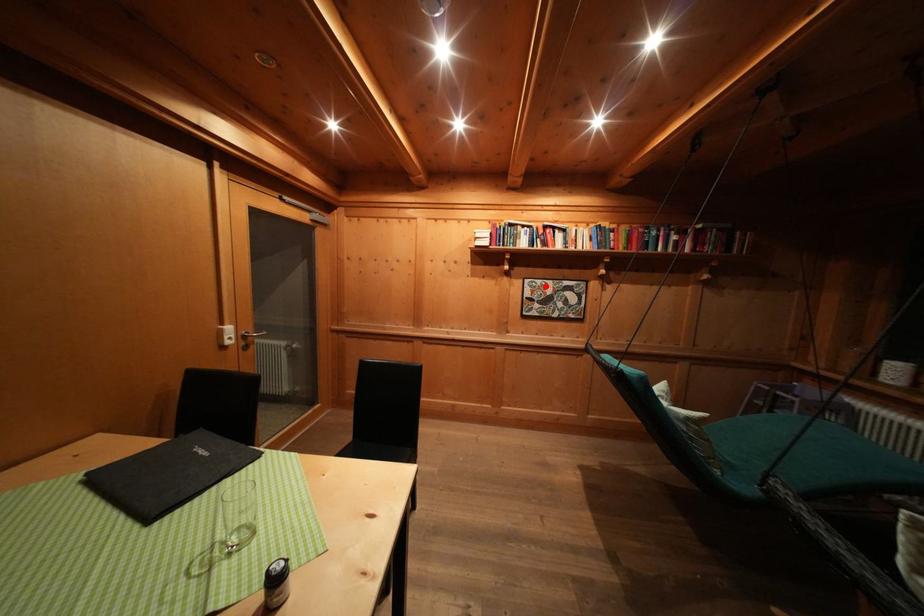
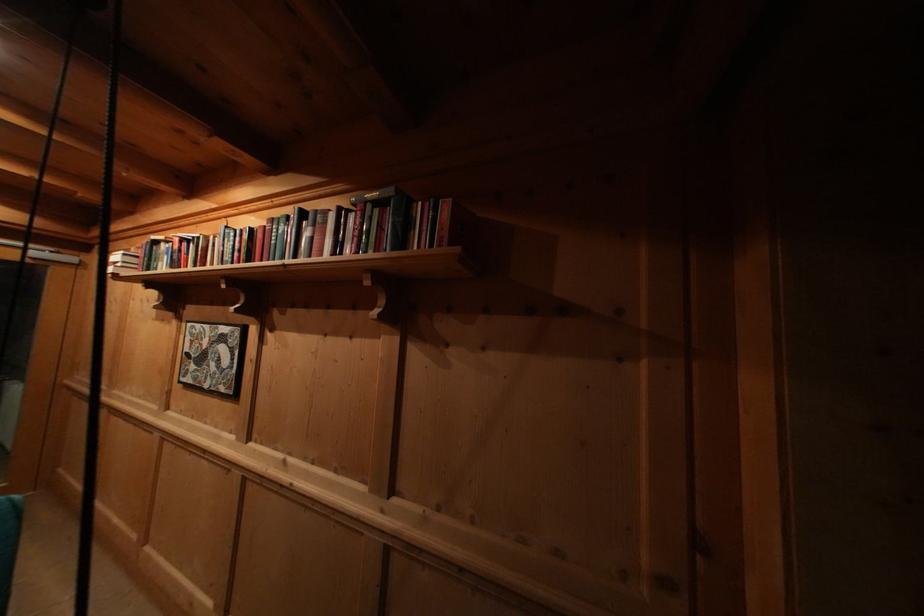
Question: I am providing you with two images of the same scene from different viewpoints. A red point is marked on the first image. At the location where the point appears in image 1, is it still visible in image 2?

Choices:
 (A) Yes
 (B) No

Answer: (A)